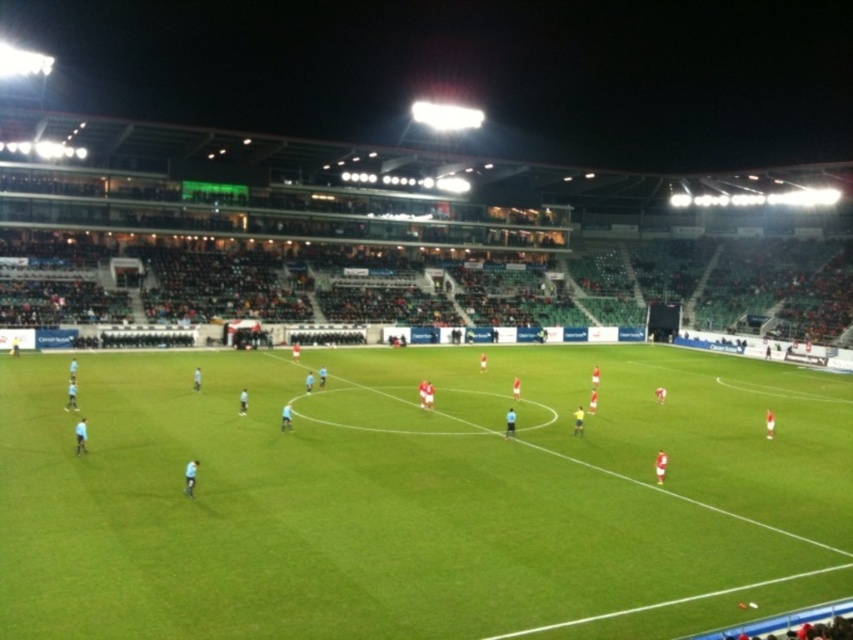
Question: Is green grass football field at center above matte red soccer team at center?

Choices:
 (A) yes
 (B) no

Answer: (B)

Question: Among these objects, which one is farthest from the camera?

Choices:
 (A) matte red soccer team at center
 (B) green grass football field at center

Answer: (A)

Question: Observing the image, what is the correct spatial positioning of green grass football field at center in reference to matte red soccer team at center?

Choices:
 (A) above
 (B) below

Answer: (B)

Question: Among these points, which one is farthest from the camera?

Choices:
 (A) (492, 442)
 (B) (363, 632)

Answer: (A)

Question: Can you confirm if green grass football field at center is positioned below matte red soccer team at center?

Choices:
 (A) no
 (B) yes

Answer: (B)